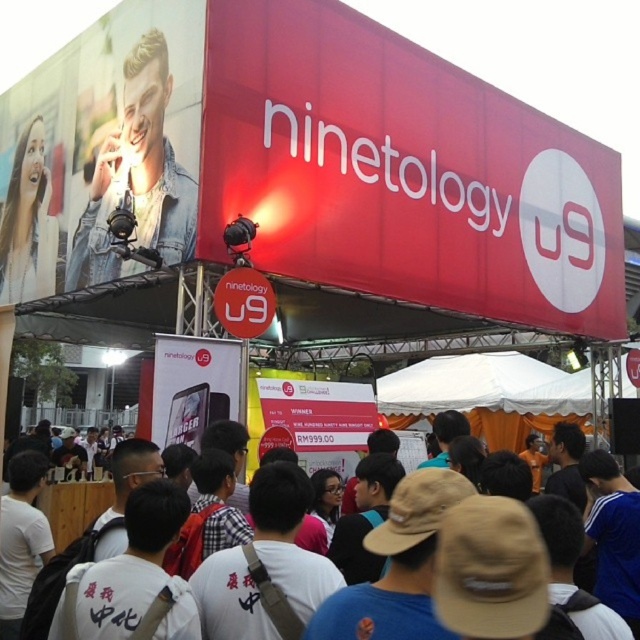
Locate an element on the screen. white cotton t-shirts at center is located at coordinates (579, 476).

Is white cotton t-shirts at center bigger than smooth skin face at upper left?

Indeed, white cotton t-shirts at center has a larger size compared to smooth skin face at upper left.

Is point (534, 497) farther from camera compared to point (26, 136)?

No, (534, 497) is closer to viewer.

Locate an element on the screen. The image size is (640, 640). white cotton t-shirts at center is located at coordinates (579, 476).

Does red matte sign at upper center have a greater width compared to smooth skin face at upper left?

Yes.

Is red matte sign at upper center positioned before smooth skin face at upper left?

Yes, red matte sign at upper center is in front of smooth skin face at upper left.

Between point (246, 70) and point (56, 237), which one is positioned behind?

Positioned behind is point (56, 237).

The image size is (640, 640). I want to click on red matte sign at upper center, so click(x=401, y=172).

Which of these two, denim jacket at upper left or smooth skin face at upper left, stands shorter?

With less height is smooth skin face at upper left.

Image resolution: width=640 pixels, height=640 pixels. Find the location of `denim jacket at upper left`. denim jacket at upper left is located at coordinates (136, 177).